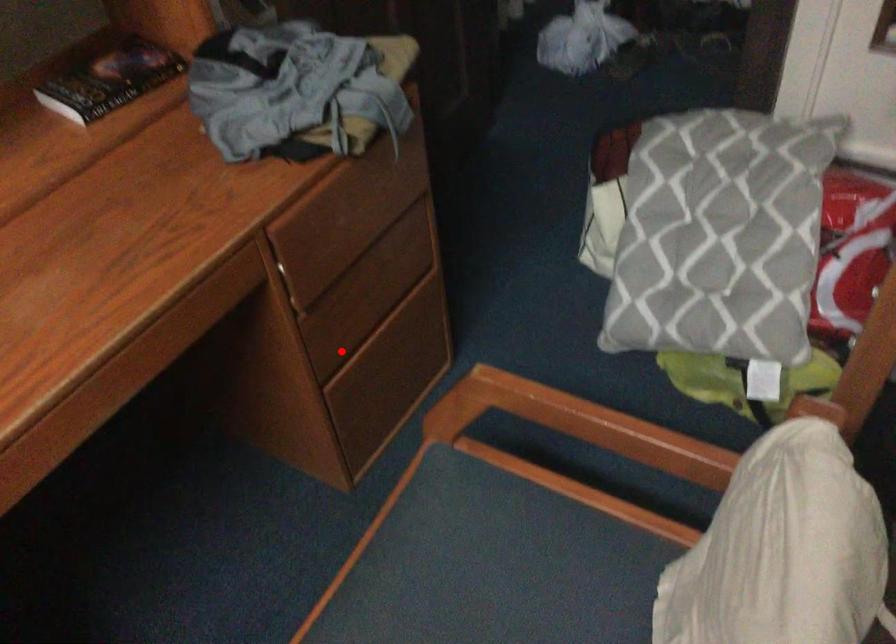
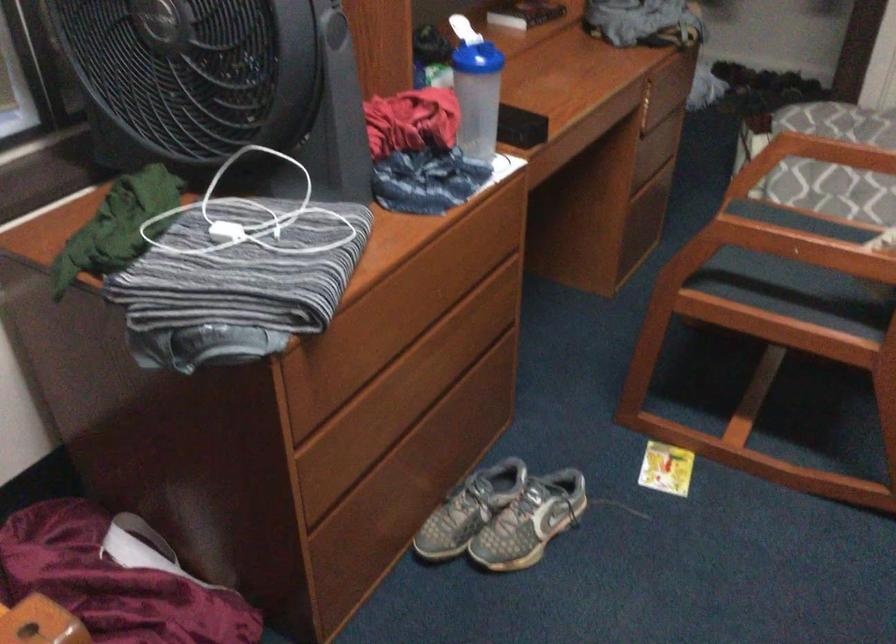
Find the pixel in the second image that matches the highlighted location in the first image.

(643, 169)